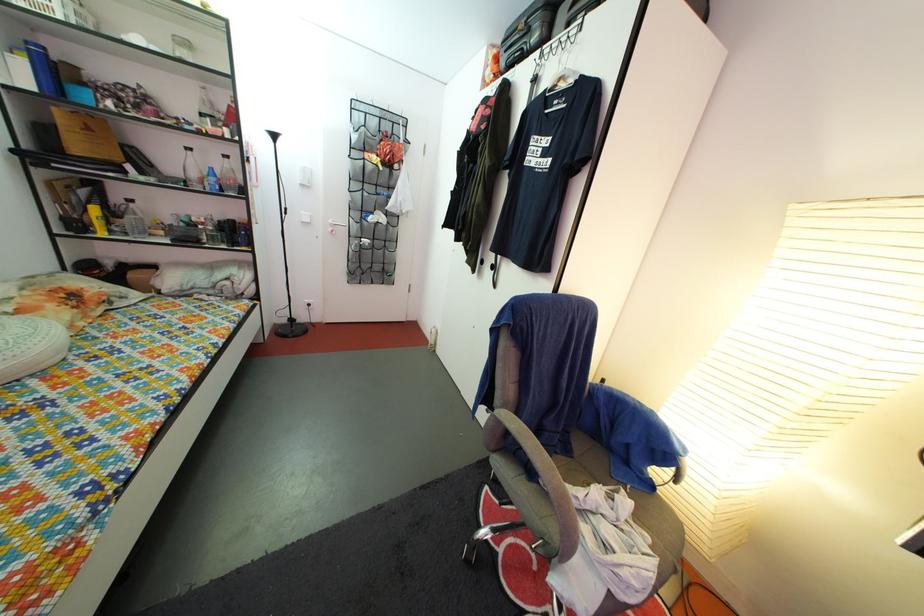
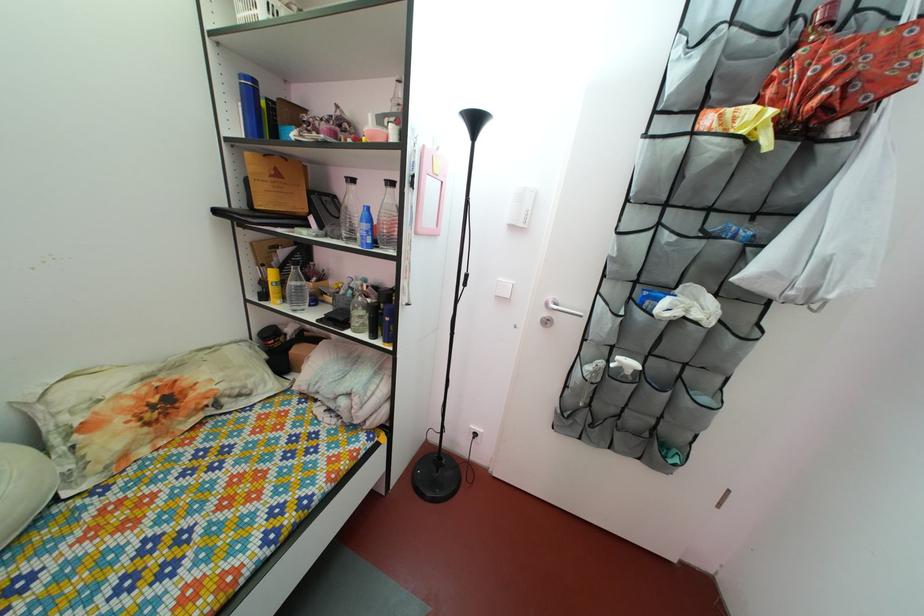
Locate, in the second image, the point that corresponds to (191,233) in the first image.

(359, 301)